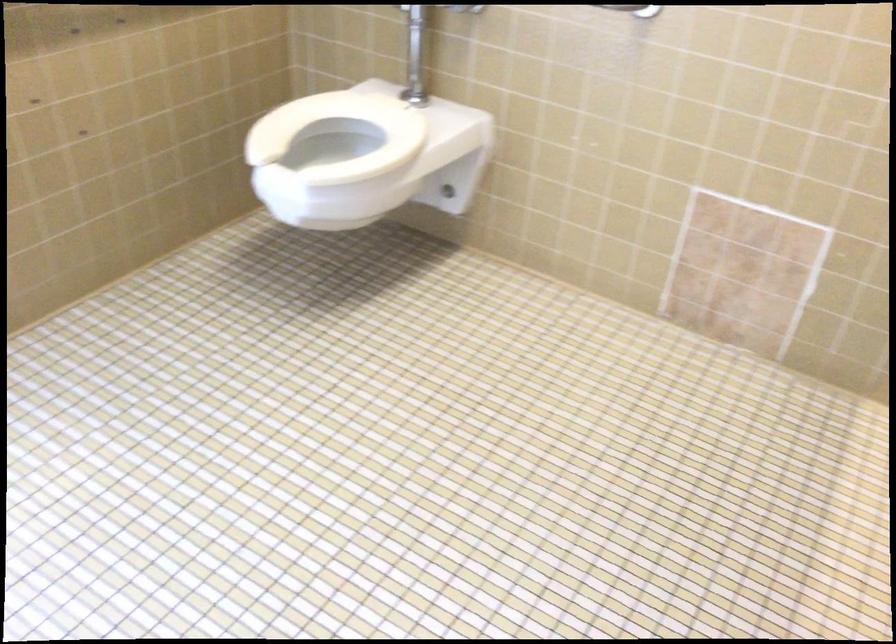
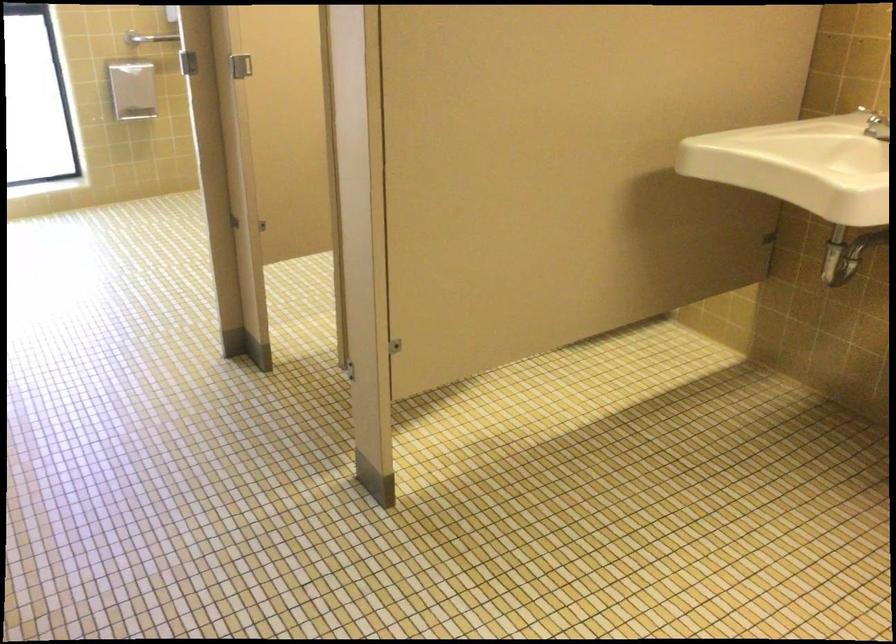
Question: I am providing you with two images of the same scene from different viewpoints. Please identify which objects are invisible in image2.

Choices:
 (A) metal stall latch
 (B) silver faucet handle
 (C) white toilet seat
 (D) glass snow globe

Answer: (C)